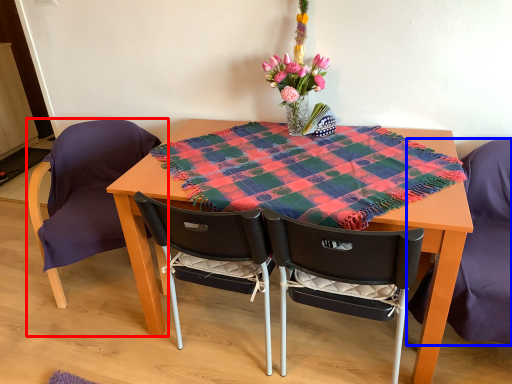
Question: Which object appears closest to the camera in this image, chair (highlighted by a red box) or chair (highlighted by a blue box)?

Choices:
 (A) chair
 (B) chair

Answer: (B)